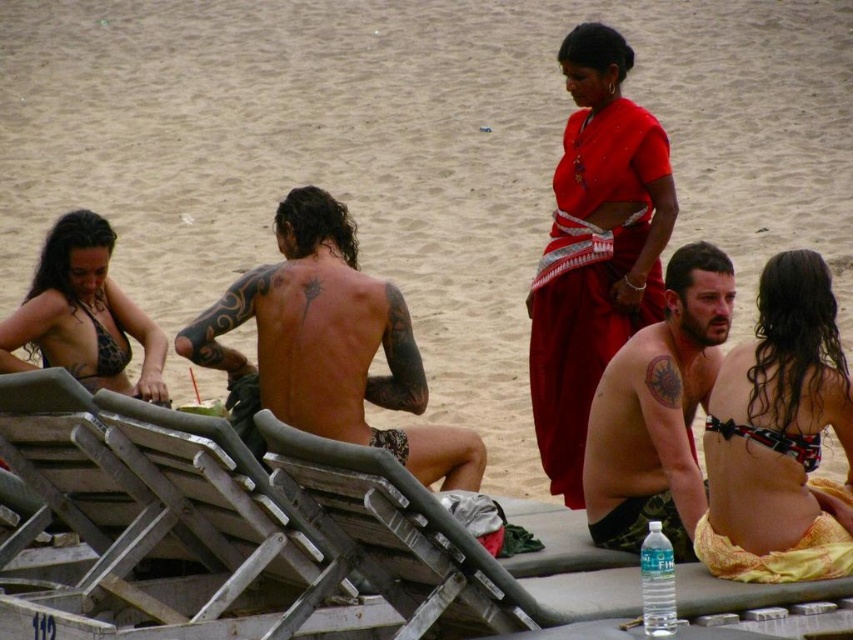
You are a photographer trying to capture a candid shot of the tattooed skin at center without including the wooden beach chair at center in the frame. Based on their positions, is this possible?

The wooden beach chair at center is to the right of the tattooed skin at center, so if you position yourself to the left side of the tattooed skin at center, you can capture the tattoo without the chair appearing in the frame.

You are a photographer at the beach and want to capture both the red silk sari at center and the printed bikini top at center in a single shot. Since you want both items to be clearly visible, does the height difference between them affect your ability to frame them together?

The red silk sari at center is much taller as the printed bikini top at center, so the height difference may require adjusting the camera angle or position to ensure both are fully visible in the frame.

You are a photographer trying to capture a shot of the printed bikini top at center and the leopard print bikini top at lower left. Since you want to ensure both are visible in the frame, which bikini top should you focus on to avoid cropping the other?

The printed bikini top at center has a lesser height compared to leopard print bikini top at lower left. Therefore, you should focus on the leopard print bikini top at lower left to ensure the shorter printed bikini top at center stays in frame.